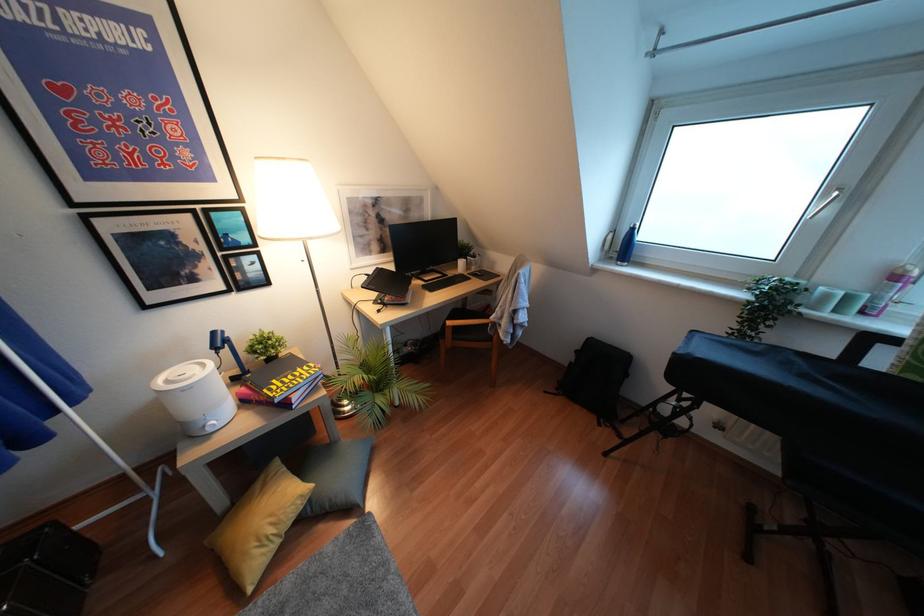
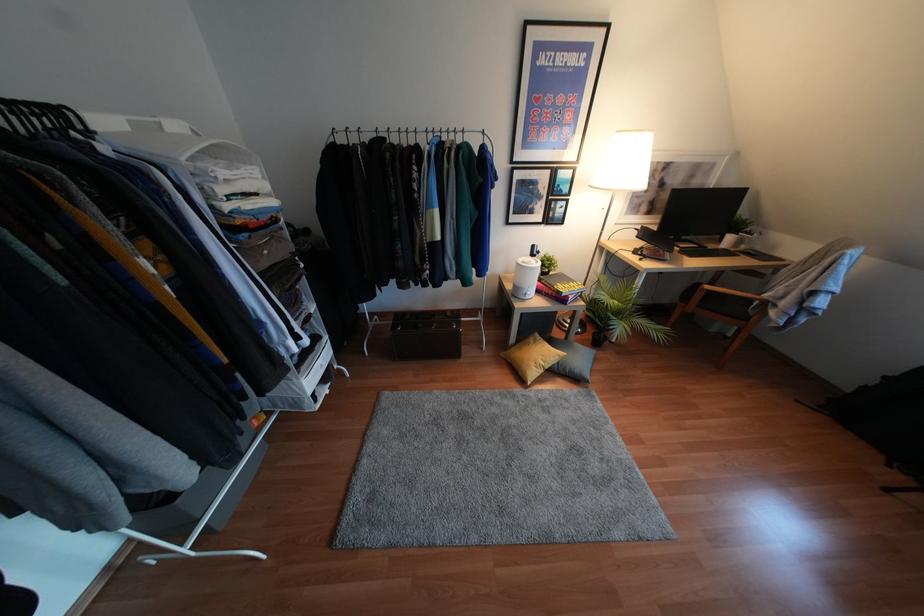
The point at [310,500] is marked in the first image. Where is the corresponding point in the second image?

(556, 362)